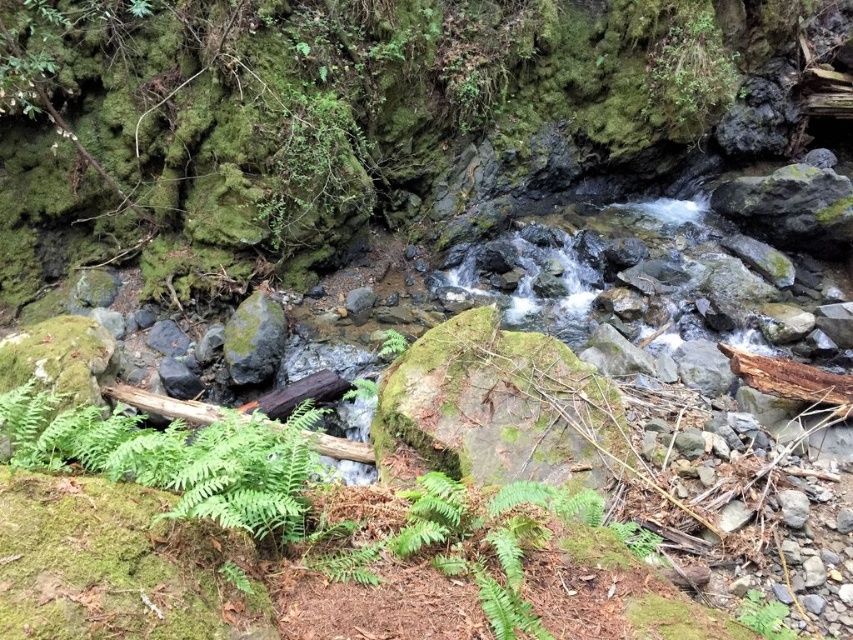
Question: From the image, what is the correct spatial relationship of green matte fern at lower left in relation to green matte fern at lower right?

Choices:
 (A) right
 (B) left

Answer: (B)

Question: Among these points, which one is farthest from the camera?

Choices:
 (A) (752, 618)
 (B) (305, 440)
 (C) (247, 372)

Answer: (C)

Question: Can you confirm if green matte fern at lower left is thinner than green matte fern at lower right?

Choices:
 (A) yes
 (B) no

Answer: (B)

Question: Is green mossy rock at center behind green matte fern at lower right?

Choices:
 (A) yes
 (B) no

Answer: (A)

Question: Among these objects, which one is nearest to the camera?

Choices:
 (A) green matte fern at lower right
 (B) green matte fern at lower left
 (C) green mossy rock at center

Answer: (B)

Question: Which object is positioned closest to the green matte fern at lower left?

Choices:
 (A) green matte fern at lower right
 (B) green mossy rock at center

Answer: (A)